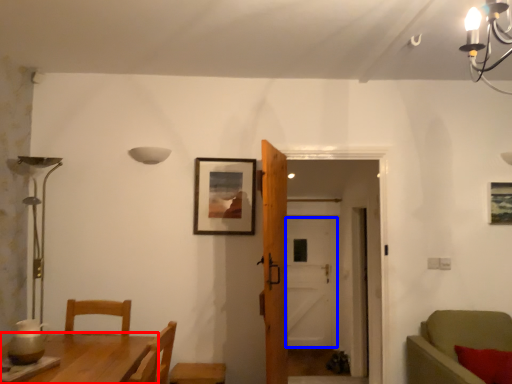
Question: Which object appears farthest to the camera in this image, table (highlighted by a red box) or door (highlighted by a blue box)?

Choices:
 (A) table
 (B) door

Answer: (B)